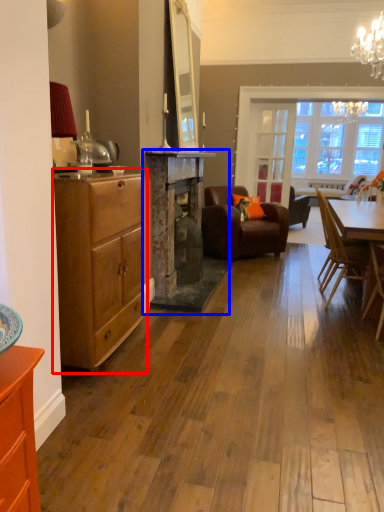
Question: Which object appears farthest to the camera in this image, chest of drawers (highlighted by a red box) or fireplace (highlighted by a blue box)?

Choices:
 (A) chest of drawers
 (B) fireplace

Answer: (B)